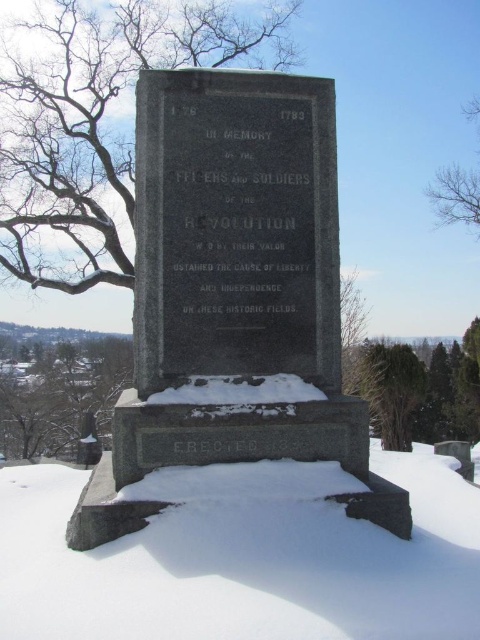
Question: Among these points, which one is nearest to the camera?

Choices:
 (A) coord(45,628)
 (B) coord(408,358)

Answer: (A)

Question: Among these objects, which one is farthest from the camera?

Choices:
 (A) green leafy tree at lower right
 (B) bare branches at left

Answer: (A)

Question: Is bare branches at upper left to the left of bare branches at upper right from the viewer's perspective?

Choices:
 (A) no
 (B) yes

Answer: (B)

Question: In this image, where is white powdery snow at lower center located relative to green textured evergreen tree at right?

Choices:
 (A) right
 (B) left

Answer: (B)

Question: Is bare branches at upper left above green textured evergreen tree at right?

Choices:
 (A) no
 (B) yes

Answer: (B)

Question: Which point is farther from the camera taking this photo?

Choices:
 (A) (204, 506)
 (B) (471, 180)

Answer: (B)